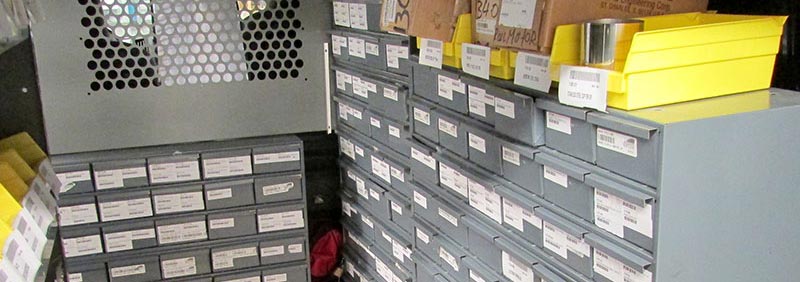
You are a GUI agent. You are given a task and a screenshot of the screen. Output one action in this format:
    pyautogui.click(x=<x>, y=<y>)
    Task: Click on the side of grey cabinet
    This screenshot has height=282, width=800.
    Given the screenshot: What is the action you would take?
    pyautogui.click(x=704, y=249)